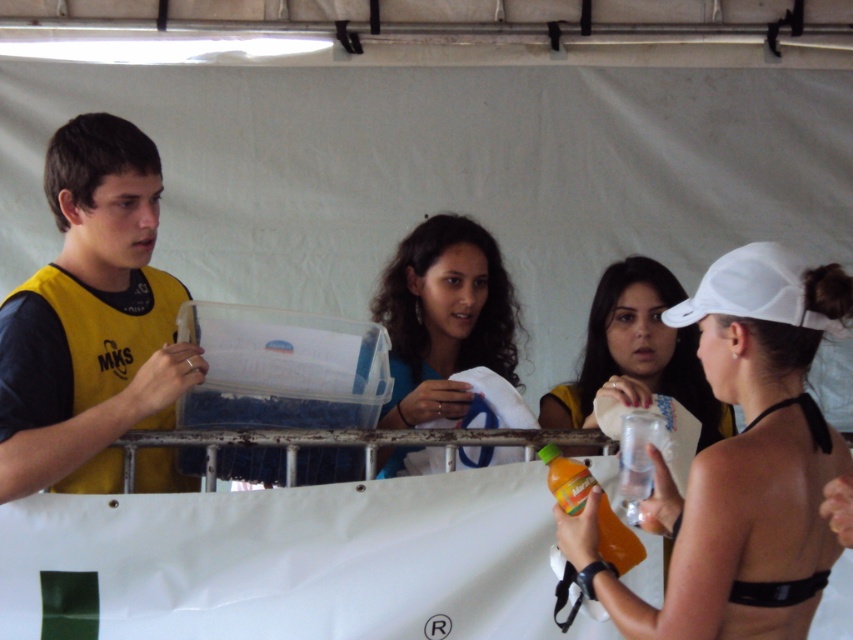
Which is more to the left, matte white cap at center or white matte baseball cap at upper right?

matte white cap at center is more to the left.

Is matte white cap at center positioned in front of white matte baseball cap at upper right?

No, it is not.

Is point (566, 417) less distant than point (676, 316)?

No.

At what (x,y) coordinates should I click in order to perform the action: click on matte white cap at center. Please return your answer as a coordinate pair (x, y). This screenshot has width=853, height=640. Looking at the image, I should click on (x=637, y=349).

The height and width of the screenshot is (640, 853). Identify the location of white matte cap at upper right. (741, 464).

Is white matte cap at upper right further to camera compared to matte white cap at center?

That is False.

The width and height of the screenshot is (853, 640). Describe the element at coordinates (741, 464) in the screenshot. I see `white matte cap at upper right` at that location.

Between point (625, 620) and point (660, 349), which one is positioned behind?

Point (660, 349)

Where is `white matte cap at upper right`? This screenshot has height=640, width=853. white matte cap at upper right is located at coordinates (741, 464).